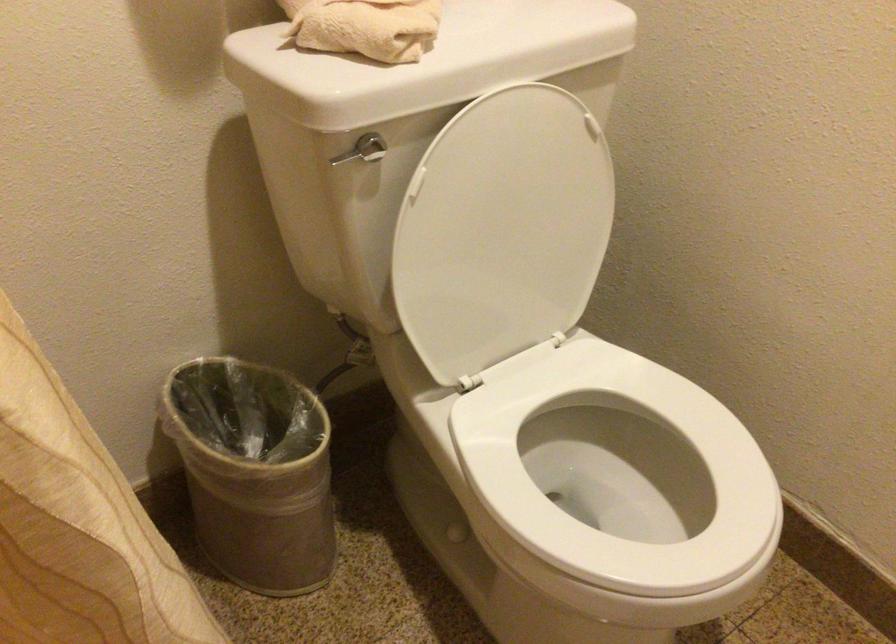
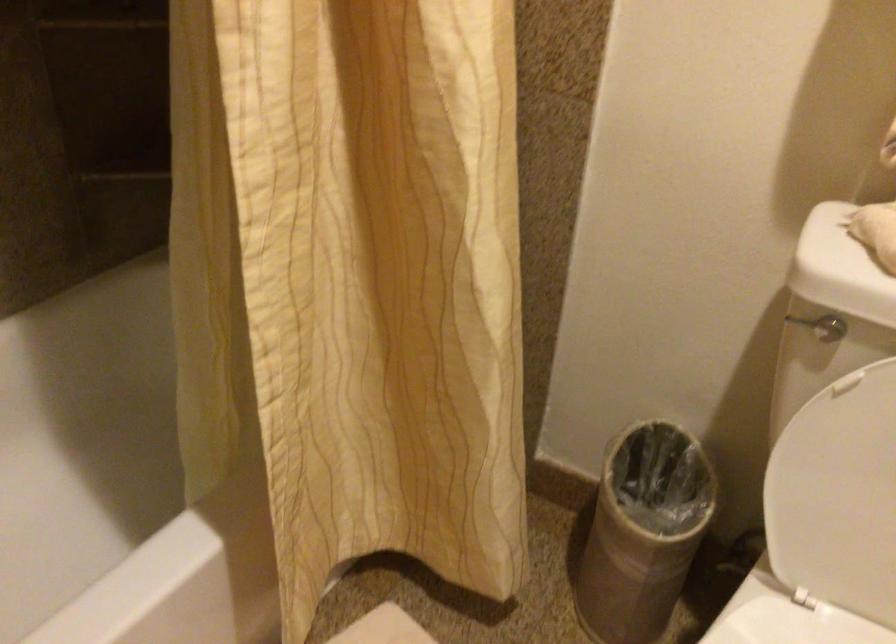
The point at (443, 274) is marked in the first image. Where is the corresponding point in the second image?

(834, 480)